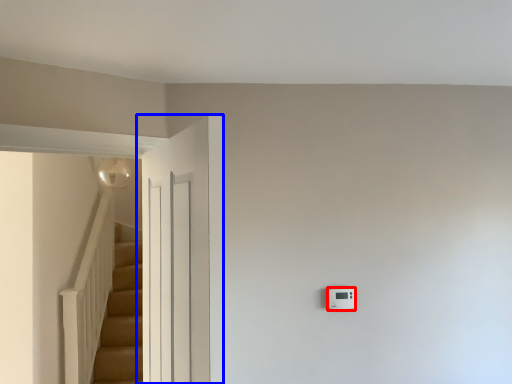
Question: Among these objects, which one is farthest to the camera, light switch (highlighted by a red box) or door (highlighted by a blue box)?

Choices:
 (A) light switch
 (B) door

Answer: (A)